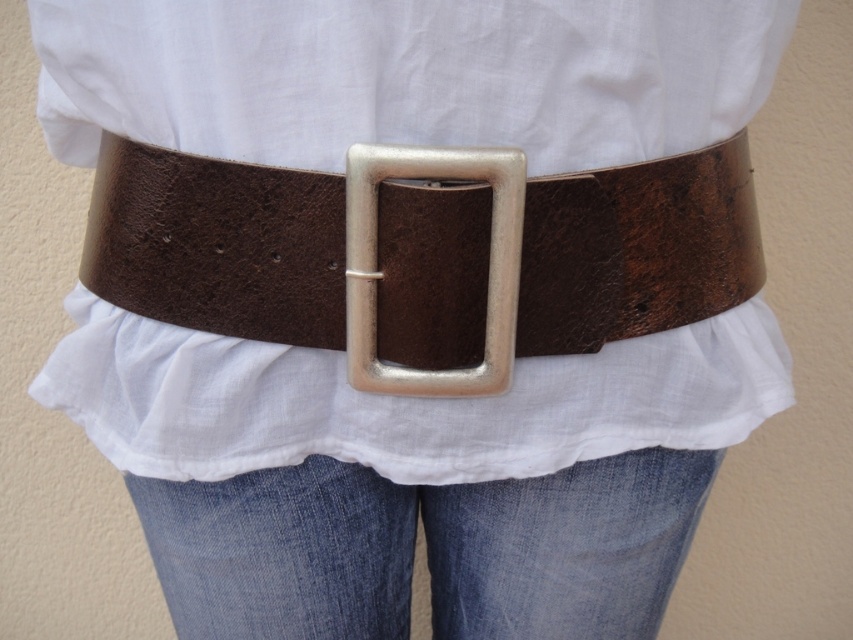
Question: Is brown leather belt at center positioned before metallic silver buckle at center?

Choices:
 (A) no
 (B) yes

Answer: (A)

Question: Which of the following is the closest to the observer?

Choices:
 (A) (773, 60)
 (B) (671, 490)
 (C) (245, 195)
 (D) (346, 304)

Answer: (C)

Question: Does brown leather belt at center have a greater width compared to metallic silver buckle at center?

Choices:
 (A) yes
 (B) no

Answer: (A)

Question: Which point is farther to the camera?

Choices:
 (A) white cotton shirt at center
 (B) metallic silver buckle at center

Answer: (B)

Question: Is brown leather belt at center thinner than denim at center?

Choices:
 (A) no
 (B) yes

Answer: (A)

Question: Which object is closer to the camera taking this photo?

Choices:
 (A) white cotton shirt at center
 (B) brown leather belt at center
 (C) denim at center

Answer: (A)